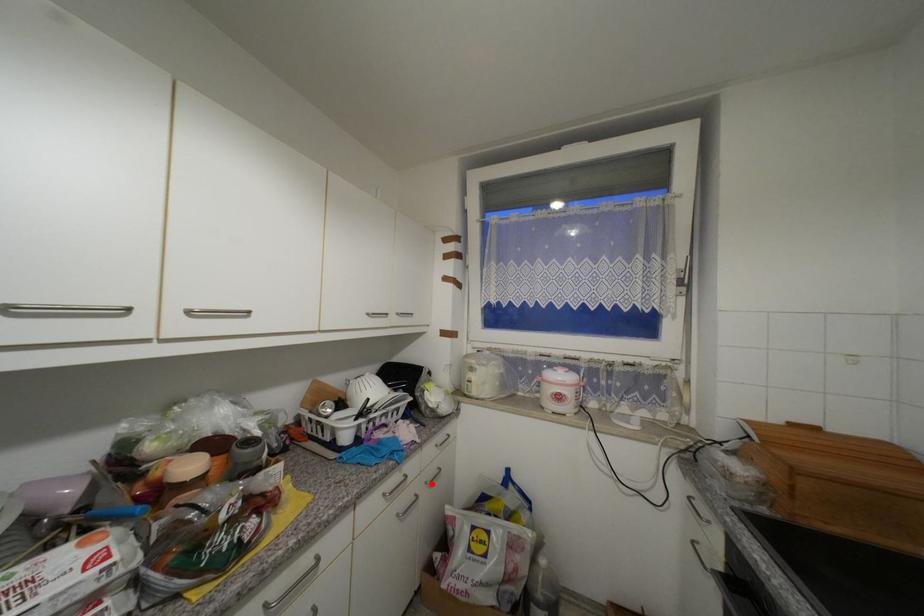
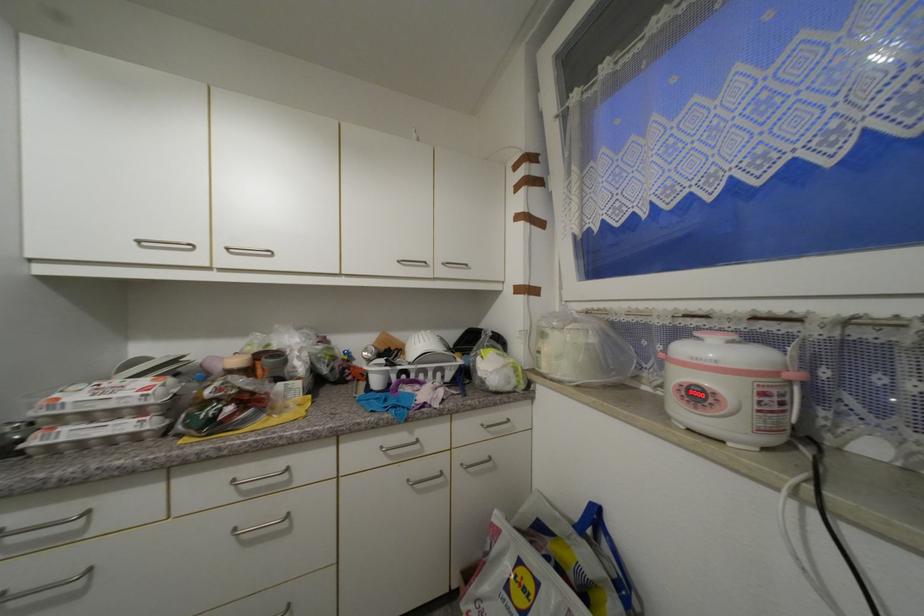
Find the pixel in the second image that matches the highlighted location in the first image.

(468, 467)